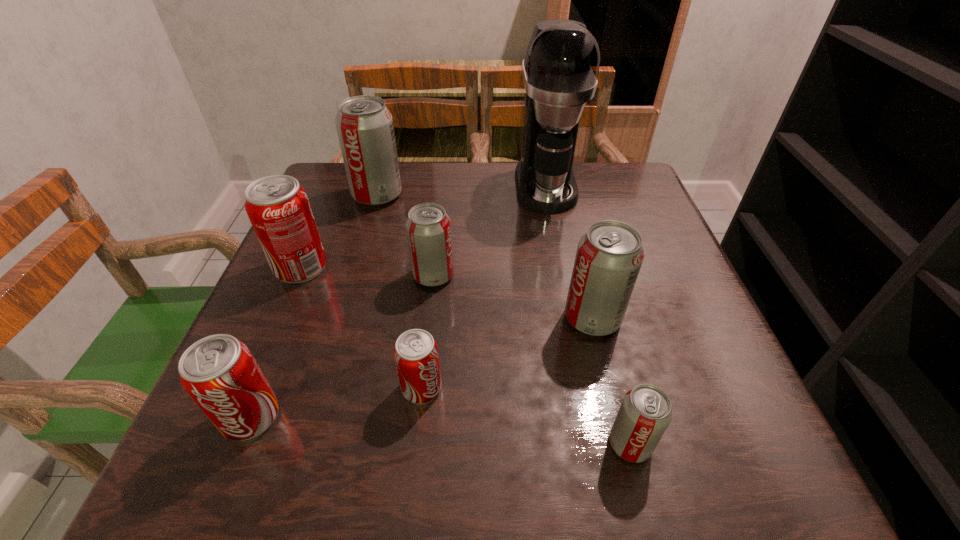
What are the coordinates of `soda can that is at the far edge` in the screenshot? It's located at coord(364,124).

Where is `object that is at the right edge`? Image resolution: width=960 pixels, height=540 pixels. object that is at the right edge is located at coordinates (609, 255).

Locate an element on the screen. object located at the far left corner is located at coordinates (364, 124).

The width and height of the screenshot is (960, 540). What are the coordinates of `object at the near left corner` in the screenshot? It's located at (219, 372).

Image resolution: width=960 pixels, height=540 pixels. Identify the location of free point at the far edge. (505, 161).

You are a GUI agent. You are given a task and a screenshot of the screen. Output one action in this format:
    pyautogui.click(x=<x>, y=<y>)
    Task: Click on the blank space at the near edge of the desktop
    This screenshot has width=960, height=540.
    Given the screenshot: What is the action you would take?
    pyautogui.click(x=342, y=449)

You are a GUI agent. You are given a task and a screenshot of the screen. Output one action in this format:
    pyautogui.click(x=<x>, y=<y>)
    Task: Click on the vacant space at the left edge
    The height and width of the screenshot is (540, 960).
    Given the screenshot: What is the action you would take?
    pyautogui.click(x=257, y=330)

You are a GUI agent. You are given a task and a screenshot of the screen. Output one action in this format:
    pyautogui.click(x=<x>, y=<y>)
    Task: Click on the vacant space at the right edge of the desktop
    This screenshot has height=540, width=960.
    Given the screenshot: What is the action you would take?
    pyautogui.click(x=709, y=397)

You are a GUI agent. You are given a task and a screenshot of the screen. Output one action in this format:
    pyautogui.click(x=<x>, y=<y>)
    Task: Click on the free space at the far left corner
    
    Given the screenshot: What is the action you would take?
    pyautogui.click(x=326, y=204)

Identify the location of free point at the far right corner. (622, 183).